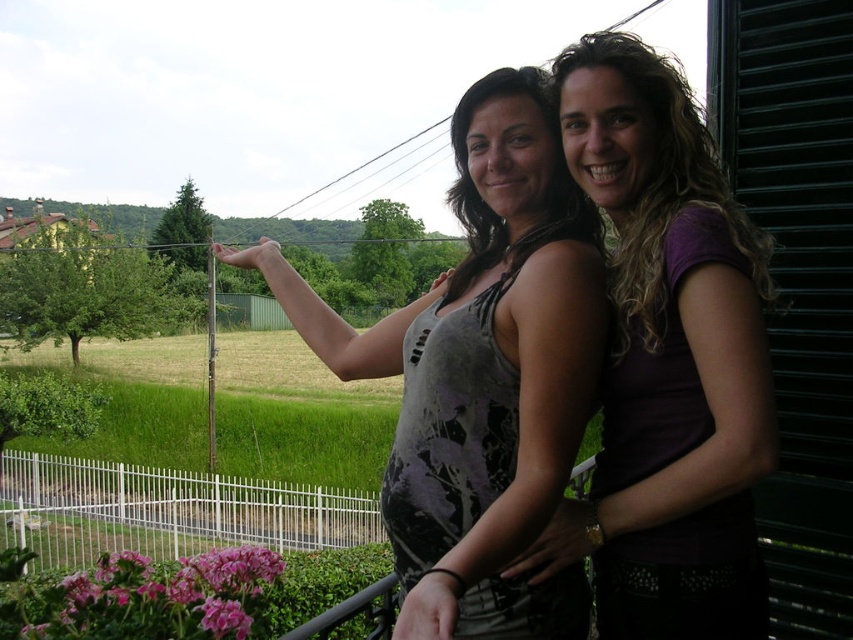
Question: Estimate the real-world distances between objects in this image. Which object is closer to the purple matte tank top at center?

Choices:
 (A) purple matte shirt at upper right
 (B) gray printed tank top at center

Answer: (A)

Question: Does gray printed tank top at center appear over purple matte shirt at upper right?

Choices:
 (A) yes
 (B) no

Answer: (B)

Question: Among these points, which one is nearest to the camera?

Choices:
 (A) (704, 616)
 (B) (403, 388)

Answer: (A)

Question: Observing the image, what is the correct spatial positioning of gray printed tank top at center in reference to purple matte tank top at center?

Choices:
 (A) above
 (B) below

Answer: (A)

Question: Can you confirm if gray printed tank top at center is bigger than purple matte tank top at center?

Choices:
 (A) yes
 (B) no

Answer: (A)

Question: Which point appears closest to the camera in this image?

Choices:
 (A) (438, 609)
 (B) (660, 372)

Answer: (A)